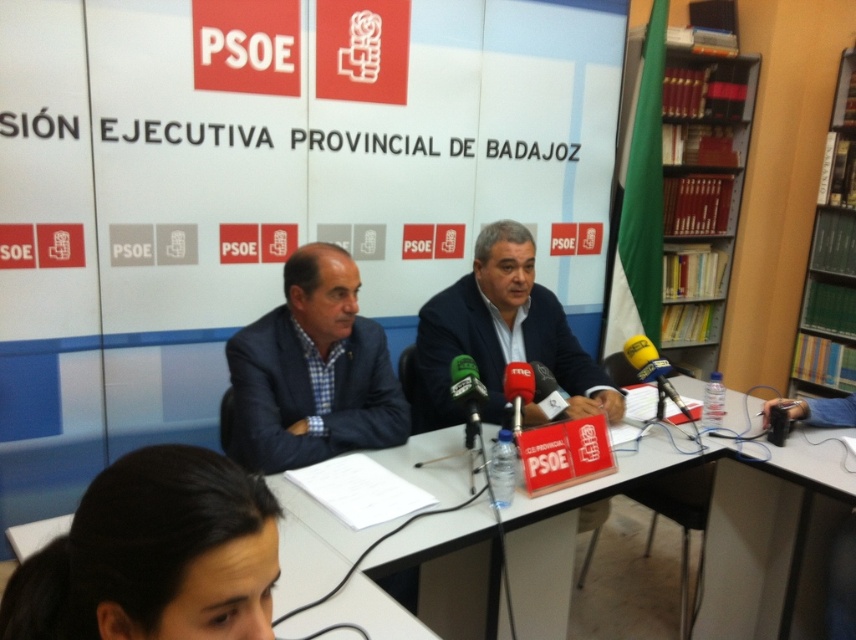
Based on the photo, you are a photographer at the press conference. You need to adjust the lighting so that it shines directly on the person with dark brown hair at lower left. Where should you aim the light? Please provide coordinates based on the image grid where the bottom left corner is 0,0 and the top right is 1,1.

The light should be aimed at the coordinates [153,556] to directly illuminate the person with dark brown hair at lower left.

You are attending a press conference and need to place a water bottle on the table. Considering the white plastic table at center and the blue fabric suit at center, which object is taller and thus more suitable for placing the bottle?

The white plastic table at center is taller than the blue fabric suit at center, so it is more suitable for placing the water bottle.